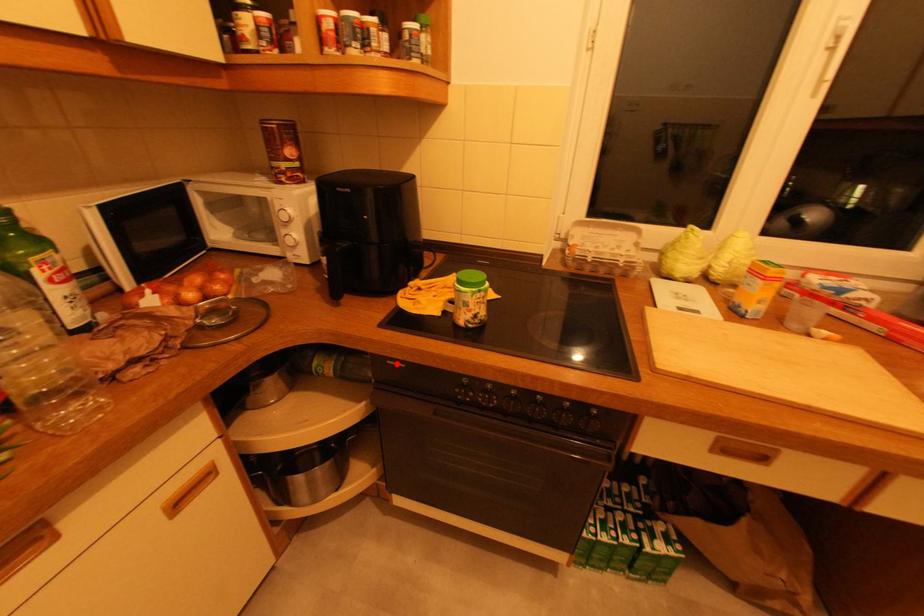
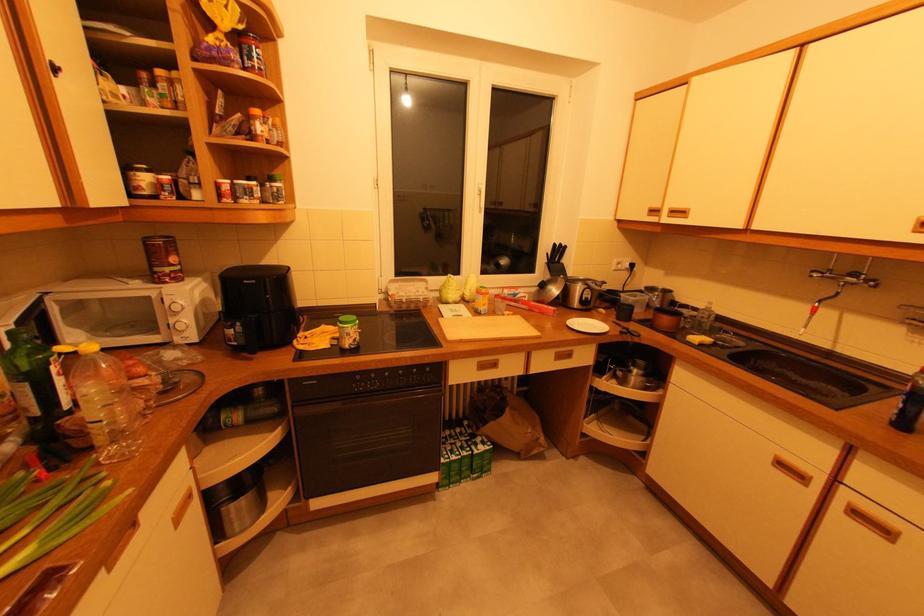
Question: I am providing you with two images of the same scene from different viewpoints. A red point is marked on the first image. Is the red point's position out of view in image 2?

Choices:
 (A) Yes
 (B) No

Answer: (B)